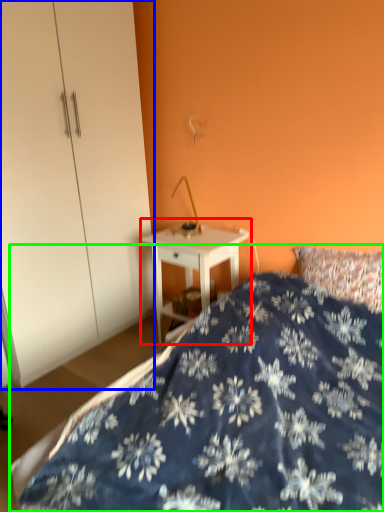
Question: Which is farther away from nightstand (highlighted by a red box)? dresser (highlighted by a blue box) or bed (highlighted by a green box)?

Choices:
 (A) dresser
 (B) bed

Answer: (B)